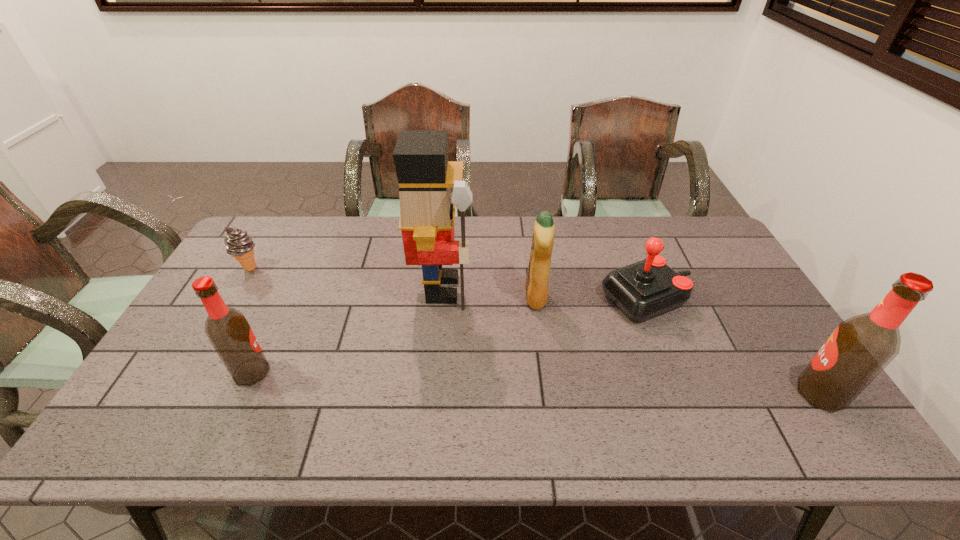
Locate an element on the screen. Image resolution: width=960 pixels, height=540 pixels. free space between the detergent and the shorter beer bottle is located at coordinates (394, 335).

Where is `empty space between the left beer bottle and the taller beer bottle`? The image size is (960, 540). empty space between the left beer bottle and the taller beer bottle is located at coordinates (536, 383).

Locate an element on the screen. This screenshot has height=540, width=960. free spot between the tallest object and the detergent is located at coordinates (490, 293).

Where is `free spot between the nutcracker and the shortest object`? This screenshot has height=540, width=960. free spot between the nutcracker and the shortest object is located at coordinates (347, 278).

What are the coordinates of `free space between the shorter beer bottle and the detergent` in the screenshot? It's located at (394, 335).

Locate an element on the screen. The width and height of the screenshot is (960, 540). free spot between the nutcracker and the taller beer bottle is located at coordinates (632, 341).

Find the location of a particular element. Image resolution: width=960 pixels, height=540 pixels. vacant region between the fifth object from right to left and the fifth tallest object is located at coordinates (449, 335).

Select which object is the closest to the taller beer bottle. Please provide its 2D coordinates. Your answer should be formatted as a tuple, i.e. [(x, y)], where the tuple contains the x and y coordinates of a point satisfying the conditions above.

[(642, 290)]

Locate an element on the screen. object identified as the fifth closest to the fifth tallest object is located at coordinates (239, 244).

Find the location of a particular element. vacant area that satisfies the following two spatial constraints: 1. in front of the second shortest object holding the staff; 2. on the right side of the tallest object is located at coordinates (442, 299).